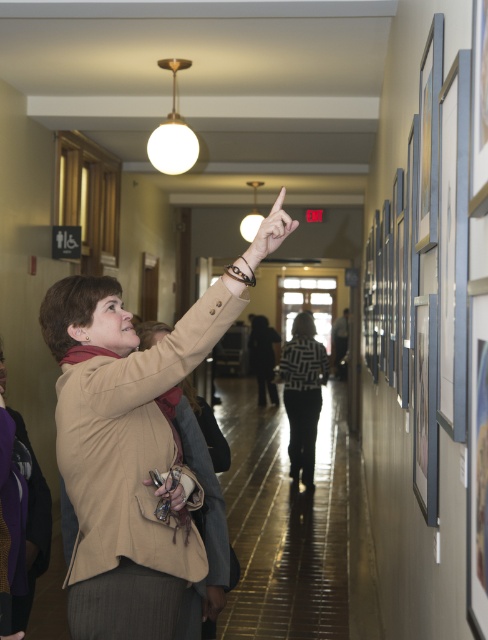
Which is above, beige fabric coat at upper left or matte brown purse at upper center?

beige fabric coat at upper left is higher up.

Consider the image. Is beige fabric coat at upper left below matte brown purse at upper center?

Actually, beige fabric coat at upper left is above matte brown purse at upper center.

Locate an element on the screen. The image size is (488, 640). beige fabric coat at upper left is located at coordinates (125, 451).

Which is above, beige fabric coat at upper left or matte skin hand at upper center?

Positioned higher is matte skin hand at upper center.

Where is `beige fabric coat at upper left`? The width and height of the screenshot is (488, 640). beige fabric coat at upper left is located at coordinates (125, 451).

Who is more forward, (x=261, y=237) or (x=178, y=509)?

Positioned in front is point (x=261, y=237).

Locate an element on the screen. This screenshot has width=488, height=640. matte skin hand at upper center is located at coordinates (269, 232).